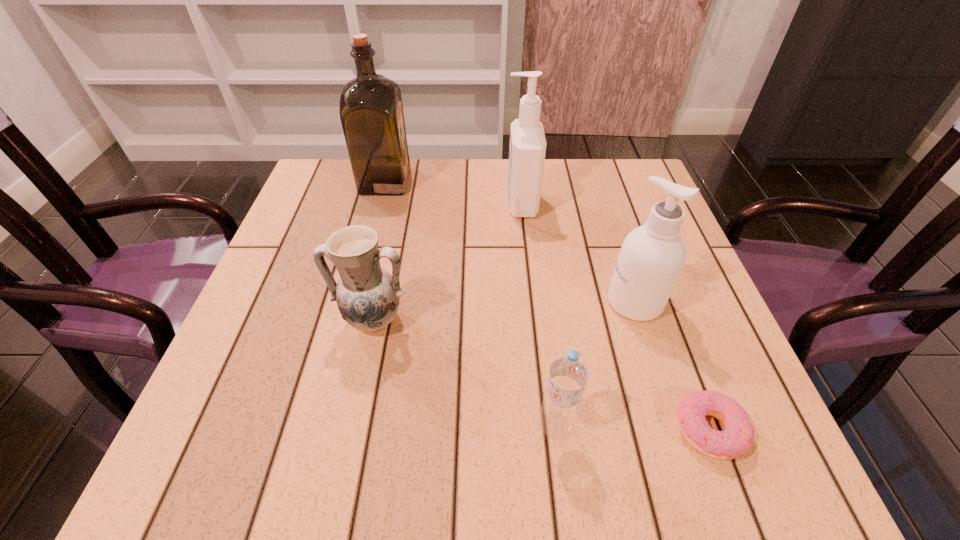
You are a GUI agent. You are given a task and a screenshot of the screen. Output one action in this format:
    pyautogui.click(x=<x>, y=<y>)
    Task: Click on the vacant region located on the front label of the farther cleansing agent
    The width and height of the screenshot is (960, 540).
    Given the screenshot: What is the action you would take?
    pyautogui.click(x=480, y=204)

Where is `vacant space located 0.130m on the front label of the nearer cleansing agent`? vacant space located 0.130m on the front label of the nearer cleansing agent is located at coordinates (540, 302).

The height and width of the screenshot is (540, 960). Identify the location of blank space located on the front label of the nearer cleansing agent. (413, 302).

At what (x,y) coordinates should I click in order to perform the action: click on vacant space located on the front label of the nearer cleansing agent. Please return your answer as a coordinate pair (x, y). Image resolution: width=960 pixels, height=540 pixels. Looking at the image, I should click on (433, 302).

At what (x,y) coordinates should I click in order to perform the action: click on vacant area located 0.060m on either side of the pottery. Please return your answer as a coordinate pair (x, y). This screenshot has height=540, width=960. Looking at the image, I should click on (362, 373).

Where is `vacant space located 0.290m on the right of the water bottle`? Image resolution: width=960 pixels, height=540 pixels. vacant space located 0.290m on the right of the water bottle is located at coordinates (758, 426).

You are a GUI agent. You are given a task and a screenshot of the screen. Output one action in this format:
    pyautogui.click(x=<x>, y=<y>)
    Task: Click on the vacant area located 0.390m on the left of the doughnut
    The image size is (960, 540).
    Given the screenshot: What is the action you would take?
    [x=422, y=430]

Find the location of a particular element. The image size is (960, 540). liquor at the far edge is located at coordinates (371, 111).

Where is `cleansing agent at the far edge`? cleansing agent at the far edge is located at coordinates [x=527, y=150].

I want to click on water bottle located in the near edge section of the desktop, so click(569, 372).